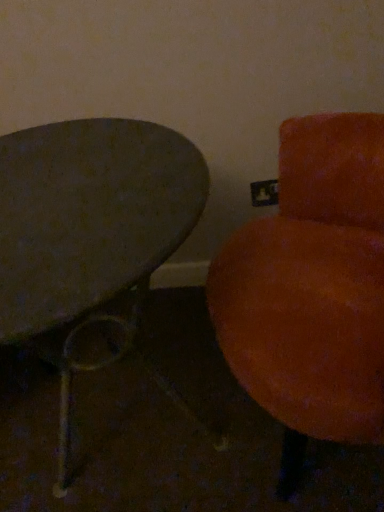
Question: Can you confirm if velvet orange chair at right is positioned to the left of metallic gray table at left?

Choices:
 (A) yes
 (B) no

Answer: (B)

Question: From a real-world perspective, is velvet orange chair at right positioned under metallic gray table at left based on gravity?

Choices:
 (A) yes
 (B) no

Answer: (B)

Question: Is velvet orange chair at right at the right side of metallic gray table at left?

Choices:
 (A) no
 (B) yes

Answer: (B)

Question: Considering the relative sizes of velvet orange chair at right and metallic gray table at left in the image provided, is velvet orange chair at right thinner than metallic gray table at left?

Choices:
 (A) no
 (B) yes

Answer: (B)

Question: Is velvet orange chair at right positioned with its back to metallic gray table at left?

Choices:
 (A) yes
 (B) no

Answer: (B)

Question: From a real-world perspective, is velvet orange chair at right on metallic gray table at left?

Choices:
 (A) yes
 (B) no

Answer: (A)

Question: Would you consider metallic gray table at left to be distant from velvet orange chair at right?

Choices:
 (A) no
 (B) yes

Answer: (A)

Question: Can you confirm if metallic gray table at left is positioned to the left of velvet orange chair at right?

Choices:
 (A) no
 (B) yes

Answer: (B)

Question: Is metallic gray table at left wider than velvet orange chair at right?

Choices:
 (A) yes
 (B) no

Answer: (A)

Question: Can we say metallic gray table at left lies outside velvet orange chair at right?

Choices:
 (A) yes
 (B) no

Answer: (A)

Question: From a real-world perspective, does metallic gray table at left stand above velvet orange chair at right?

Choices:
 (A) yes
 (B) no

Answer: (B)

Question: From a real-world perspective, is metallic gray table at left beneath velvet orange chair at right?

Choices:
 (A) no
 (B) yes

Answer: (B)

Question: In the image, is metallic gray table at left positioned in front of or behind velvet orange chair at right?

Choices:
 (A) behind
 (B) front

Answer: (A)